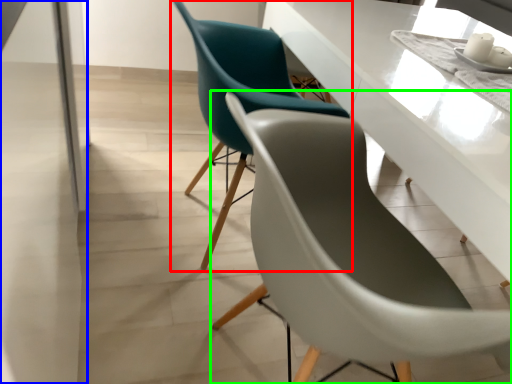
Question: Which object is the closest to the chair (highlighted by a red box)? Choose among these: glass door (highlighted by a blue box) or chair (highlighted by a green box).

Choices:
 (A) glass door
 (B) chair

Answer: (B)